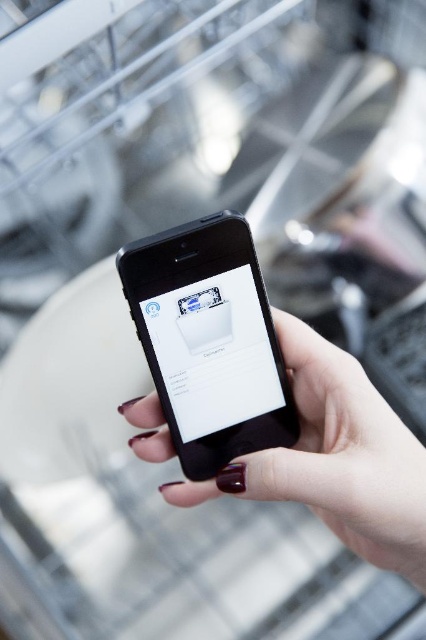
You are a technician in a workshop and need to choose between two phones displayed on the screen. The black glossy phone at center and the black matte phone at center. Which one is thinner?

The black glossy phone at center is thinner than the black matte phone at center according to the description.

You are a technician in a workshop and need to identify which phone is closer to you. You see a black glossy phone at center and a black matte phone at center. Which one is nearer to you?

The black glossy phone at center is nearer to you because it is positioned closer to the viewer than the black matte phone at center.